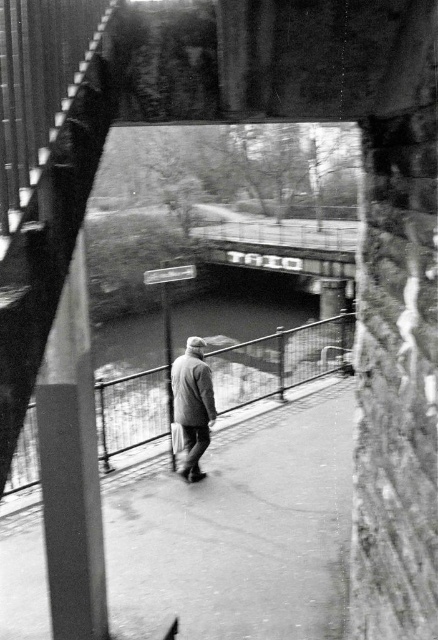
Does smooth concrete pavement at center have a greater width compared to gray woolen jacket at center?

Correct, the width of smooth concrete pavement at center exceeds that of gray woolen jacket at center.

Does smooth concrete pavement at center appear under gray woolen jacket at center?

Indeed, smooth concrete pavement at center is positioned under gray woolen jacket at center.

Is point (310, 522) closer to camera compared to point (201, 378)?

That is True.

The height and width of the screenshot is (640, 438). What are the coordinates of `smooth concrete pavement at center` in the screenshot? It's located at (242, 531).

Who is more distant from viewer, (329, 260) or (189, 476)?

Point (329, 260)

Is point (215, 253) less distant than point (205, 385)?

No, it is behind (205, 385).

You are a GUI agent. You are given a task and a screenshot of the screen. Output one action in this format:
    pyautogui.click(x=<x>, y=<y>)
    Task: Click on the metallic sign at center
    The image size is (438, 640).
    Given the screenshot: What is the action you would take?
    pyautogui.click(x=281, y=246)

Who is higher up, smooth concrete pavement at center or smooth metal rail at center?

Positioned higher is smooth metal rail at center.

Where is `smooth concrete pavement at center`? The image size is (438, 640). smooth concrete pavement at center is located at coordinates (242, 531).